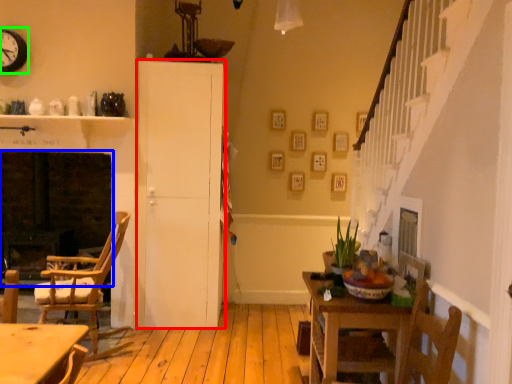
Question: Based on their relative distances, which object is farther from cabinetry (highlighted by a red box)? Choose from fireplace (highlighted by a blue box) and clock (highlighted by a green box).

Choices:
 (A) fireplace
 (B) clock

Answer: (B)